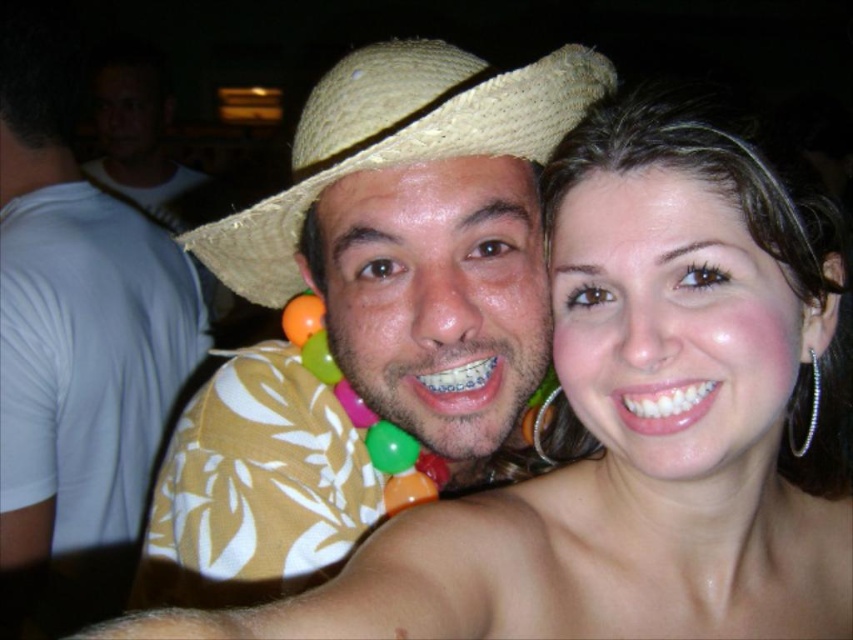
Based on the photo, can you confirm if strawmaterial/texturecowboy hat at upper center is positioned below silver metallic hoop earring at right?

No, strawmaterial/texturecowboy hat at upper center is not below silver metallic hoop earring at right.

Does strawmaterial/texturecowboy hat at upper center have a lesser width compared to silver metallic hoop earring at right?

In fact, strawmaterial/texturecowboy hat at upper center might be wider than silver metallic hoop earring at right.

What do you see at coordinates (396, 140) in the screenshot? I see `strawmaterial/texturecowboy hat at upper center` at bounding box center [396, 140].

What are the coordinates of `strawmaterial/texturecowboy hat at upper center` in the screenshot? It's located at (396, 140).